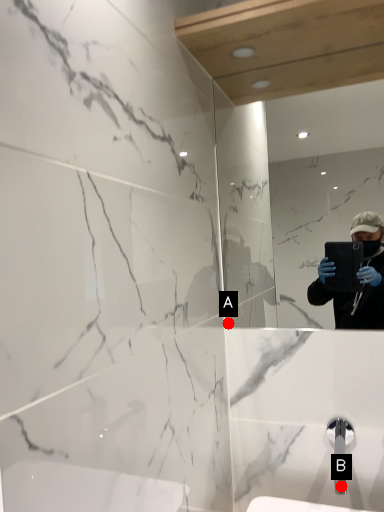
Question: Two points are circled on the image, labeled by A and B beside each circle. Among these points, which one is nearest to the camera?

Choices:
 (A) A is closer
 (B) B is closer

Answer: (B)